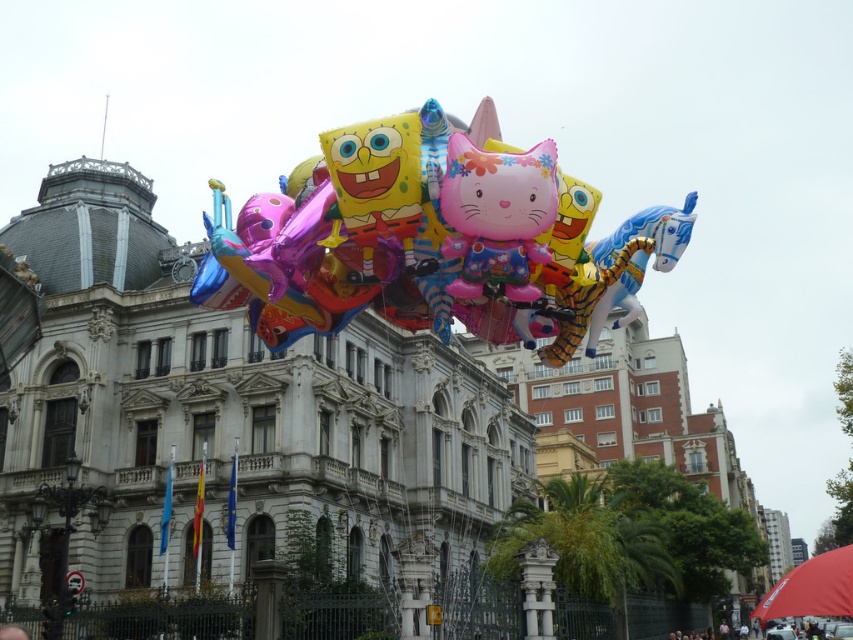
Is glossy plastic cat at center taller than dark blue fabric at center?

Indeed, glossy plastic cat at center has a greater height compared to dark blue fabric at center.

Does glossy plastic cat at center appear under dark blue fabric at center?

Actually, glossy plastic cat at center is above dark blue fabric at center.

Image resolution: width=853 pixels, height=640 pixels. Describe the element at coordinates (497, 216) in the screenshot. I see `glossy plastic cat at center` at that location.

Identify the location of glossy plastic cat at center. (497, 216).

Is glossy metallic balloons at center above glossy plastic cat at center?

Indeed, glossy metallic balloons at center is positioned over glossy plastic cat at center.

This screenshot has height=640, width=853. Identify the location of glossy metallic balloons at center. (432, 240).

Does glossy metallic balloons at center appear on the right side of dark blue fabric at center?

In fact, glossy metallic balloons at center is to the left of dark blue fabric at center.

Locate an element on the screen. This screenshot has height=640, width=853. glossy metallic balloons at center is located at coordinates (432, 240).

Is point (235, 246) in front of point (724, 634)?

Yes, point (235, 246) is closer to viewer.

You are a GUI agent. You are given a task and a screenshot of the screen. Output one action in this format:
    pyautogui.click(x=<x>, y=<y>)
    Task: Click on the glossy metallic balloons at center
    This screenshot has height=640, width=853.
    Given the screenshot: What is the action you would take?
    pyautogui.click(x=432, y=240)